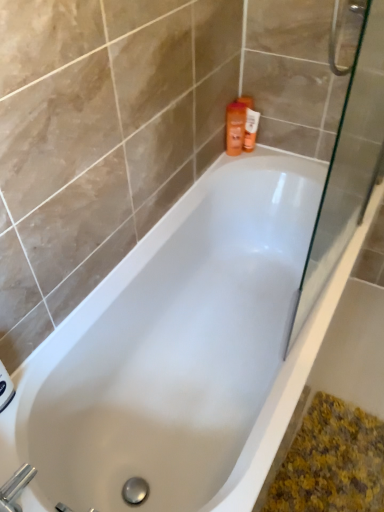
The height and width of the screenshot is (512, 384). I want to click on spots to the right of orange plastic bottle at upper right, so click(x=289, y=160).